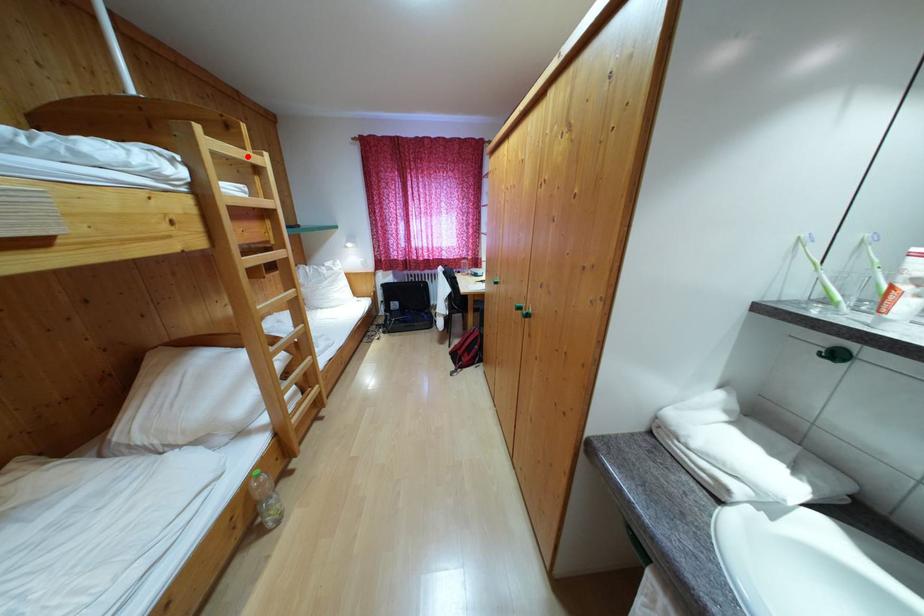
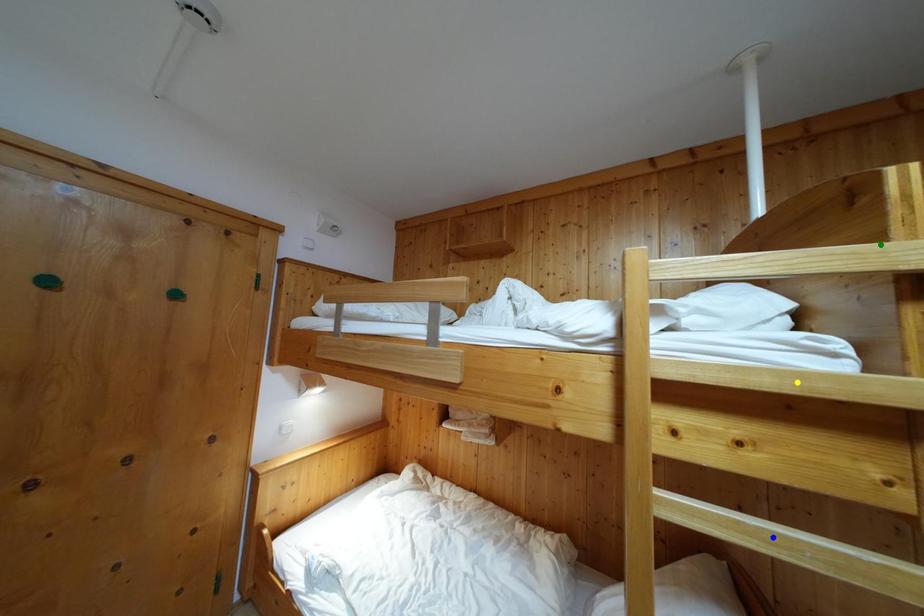
Question: I am providing you with two images of the same scene from different viewpoints. A red point is marked on the first image. You are given multiple points on the second image. Which point in image 2 is actually the same real-world point as the red point in image 1?

Choices:
 (A) yellow point
 (B) green point
 (C) blue point

Answer: (B)